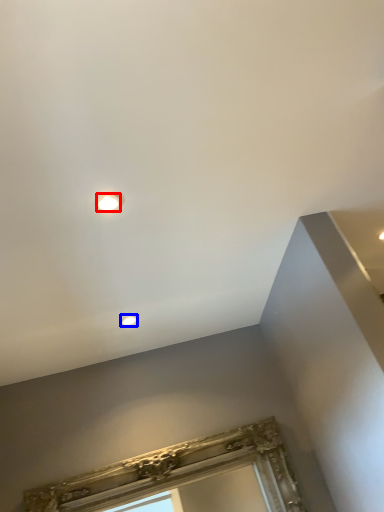
Question: Which point is further to the camera, droplight (highlighted by a red box) or droplight (highlighted by a blue box)?

Choices:
 (A) droplight
 (B) droplight

Answer: (B)